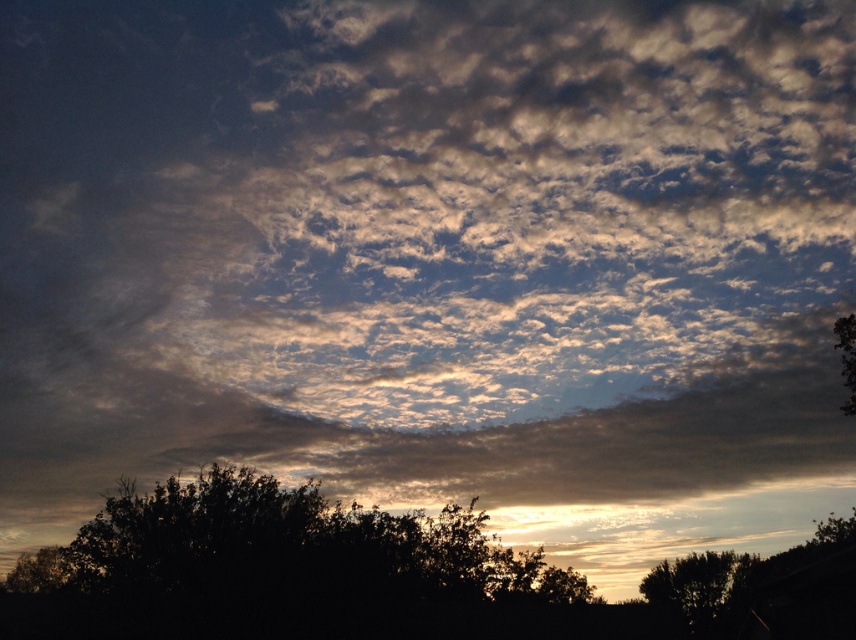
You are an astronomer observing the sky scene. You need to determine the exact location of the dark green leafy tree at lower center. What are its coordinates?

The dark green leafy tree at lower center is located at coordinates point [275,561].

You are an artist trying to sketch the scene. You need to place the dark green leafy tree at lower center and the silhouette leafy tree at lower right in your drawing. Based on the scene description, which tree should you draw to the left side of the other?

You should draw the dark green leafy tree at lower center to the left of the silhouette leafy tree at lower right because the dark green leafy tree at lower center is positioned to the left of the silhouette leafy tree at lower right in the scene.

You are standing in a field and see the dark green leafy tree at lower center and the silhouette leafy tree at lower right. Which tree would appear larger to you?

The dark green leafy tree at lower center appears larger because it is closer to the viewer than the silhouette leafy tree at lower right.